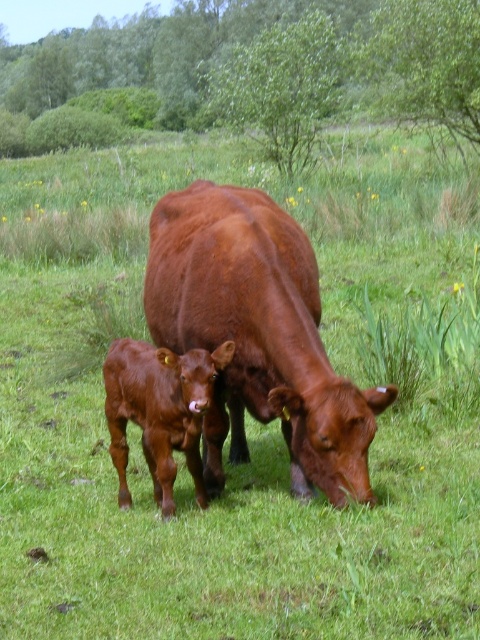
The height and width of the screenshot is (640, 480). Describe the element at coordinates (257, 333) in the screenshot. I see `shiny brown cow at center` at that location.

Image resolution: width=480 pixels, height=640 pixels. What do you see at coordinates (257, 333) in the screenshot?
I see `shiny brown cow at center` at bounding box center [257, 333].

You are a GUI agent. You are given a task and a screenshot of the screen. Output one action in this format:
    pyautogui.click(x=<x>, y=<y>)
    Task: Click on the shiny brown cow at center
    
    Given the screenshot: What is the action you would take?
    pyautogui.click(x=257, y=333)